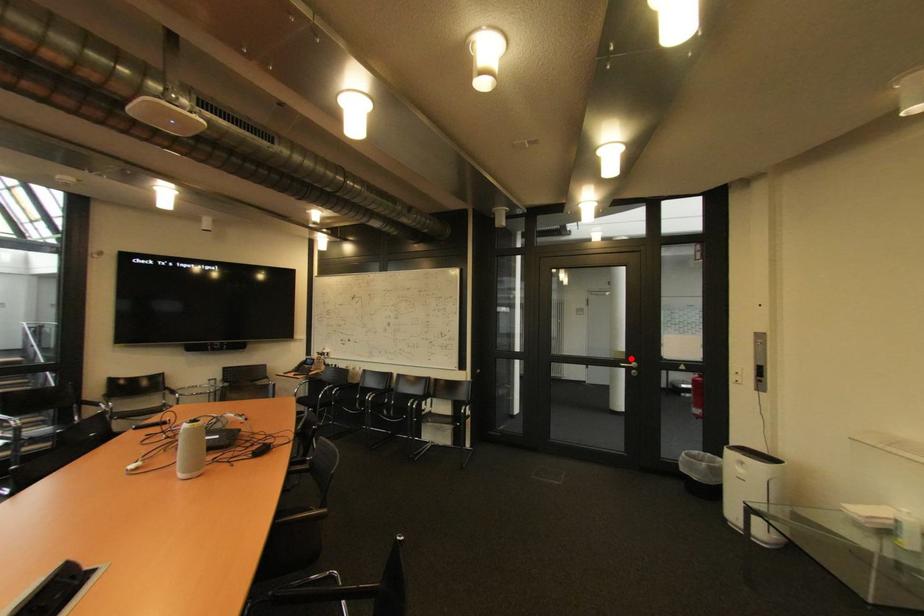
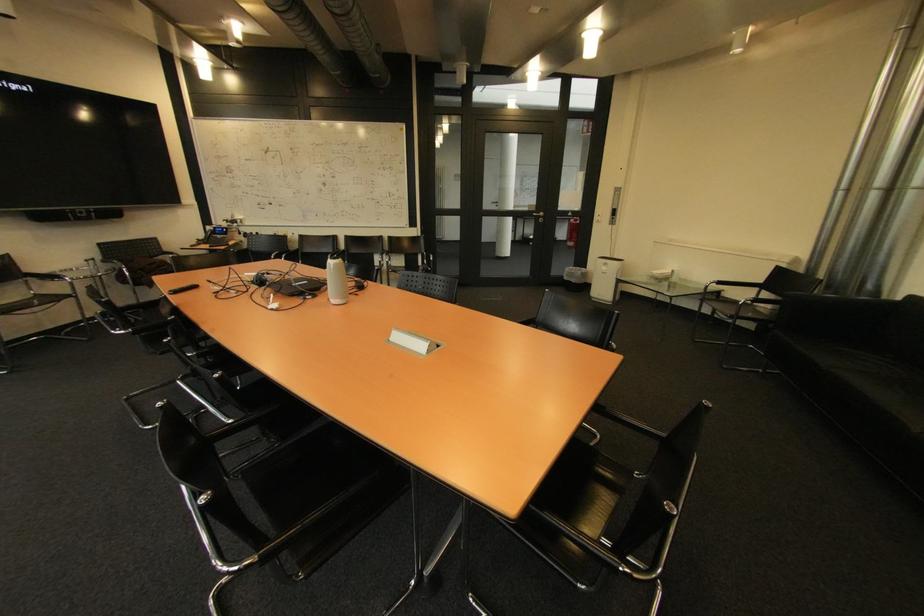
Question: A red point is marked in image1. In image2, is the corresponding 3D point closer to the camera or farther? Reply with the corresponding letter.

Choices:
 (A) The corresponding 3D point is closer.
 (B) The corresponding 3D point is farther.

Answer: (A)